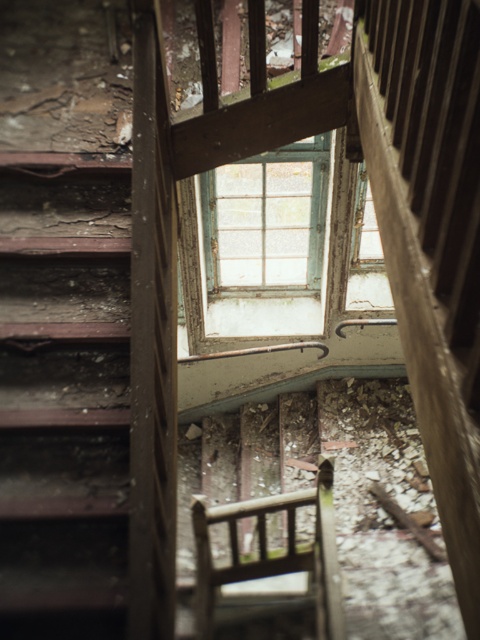
Does green weathered wood window at center have a larger size compared to wooden chair at center?

Correct, green weathered wood window at center is larger in size than wooden chair at center.

Describe the element at coordinates (266, 218) in the screenshot. I see `green weathered wood window at center` at that location.

This screenshot has height=640, width=480. What are the coordinates of `green weathered wood window at center` in the screenshot? It's located at (266, 218).

Can you confirm if rusty metal stairs at left is taller than wooden chair at center?

Correct, rusty metal stairs at left is much taller as wooden chair at center.

Who is shorter, rusty metal stairs at left or wooden chair at center?

wooden chair at center is shorter.

Is point (111, 490) in front of point (288, 547)?

Yes, point (111, 490) is in front of point (288, 547).

In order to click on rusty metal stairs at left in this screenshot , I will do `click(63, 400)`.

Is rusty metal stairs at left bigger than green weathered wood window at center?

No, rusty metal stairs at left is not bigger than green weathered wood window at center.

Which of these two, rusty metal stairs at left or green weathered wood window at center, stands shorter?

green weathered wood window at center

The height and width of the screenshot is (640, 480). What are the coordinates of `rusty metal stairs at left` in the screenshot? It's located at (63, 400).